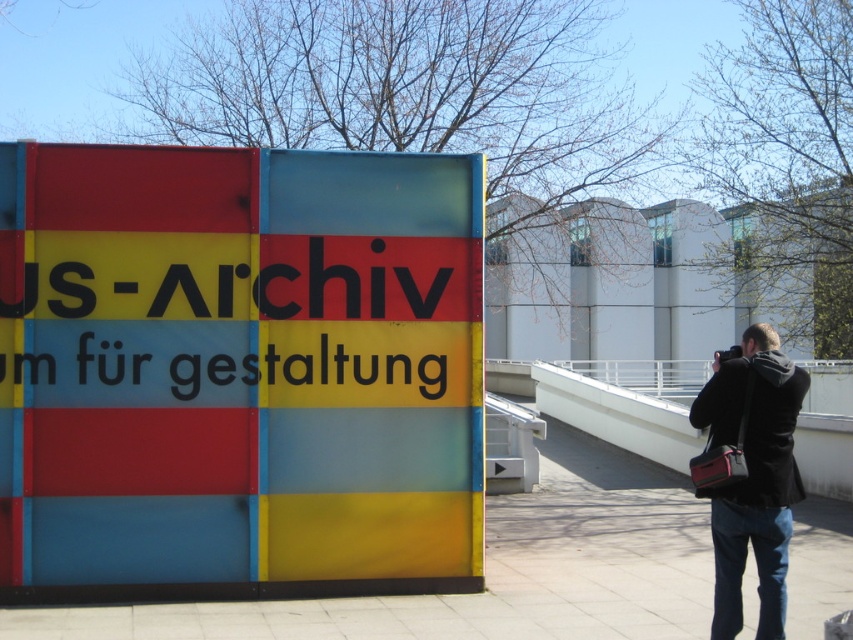
You are a photographer who wants to place a small tripod between the matte plastic sign at center and the black fabric camera bag at lower right. Can you position it directly in between them?

The matte plastic sign at center is located above the black fabric camera bag at lower right, so there is vertical space between them. The tripod can be placed directly in between them horizontally, but since the sign is above the bag, the vertical positioning would require placing it below the sign and above the bag.

You are a photographer standing 6 meters away from the matte plastic sign at center. You want to take a clear photo of it. Can you move closer to the sign without exceeding the 6.89 meters distance mentioned in the description?

Yes, you can move closer to the matte plastic sign at center as long as you stay within 6.89 meters, since the current distance is 6 meters, which is less than the maximum allowed distance of 6.89 meters.

You are a photographer at the exhibition. You need to place a small sticker on the object that is smaller between the matte plastic sign at center and the black fabric camera bag at lower right. Which object should you place the sticker on?

The black fabric camera bag at lower right is smaller than the matte plastic sign at center, so you should place the sticker on the black fabric camera bag at lower right.